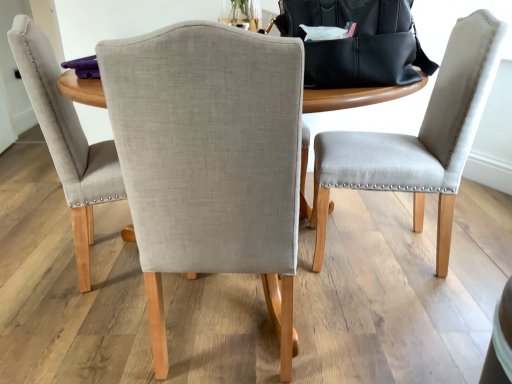
Question: From the image's perspective, is black leather messenger bag at upper center below light gray fabric chair at center, the 1th chair viewed from the left?

Choices:
 (A) no
 (B) yes

Answer: (A)

Question: Does black leather messenger bag at upper center have a greater height compared to light gray fabric chair at center, the 1th chair viewed from the left?

Choices:
 (A) yes
 (B) no

Answer: (B)

Question: Is black leather messenger bag at upper center at the right side of light gray fabric chair at center, the 1th chair viewed from the left?

Choices:
 (A) no
 (B) yes

Answer: (B)

Question: Can you confirm if black leather messenger bag at upper center is positioned to the left of light gray fabric chair at center, arranged as the 3th chair when viewed from the right?

Choices:
 (A) yes
 (B) no

Answer: (B)

Question: From a real-world perspective, is black leather messenger bag at upper center below light gray fabric chair at center, the 1th chair viewed from the left?

Choices:
 (A) yes
 (B) no

Answer: (B)

Question: Considering their positions, is light gray fabric chair at center, placed as the second chair when sorted from left to right, located in front of or behind black leather messenger bag at upper center?

Choices:
 (A) behind
 (B) front

Answer: (B)

Question: Looking at their shapes, would you say light gray fabric chair at center, the second chair in the right-to-left sequence, is wider or thinner than black leather messenger bag at upper center?

Choices:
 (A) thin
 (B) wide

Answer: (B)

Question: From the image's perspective, is light gray fabric chair at center, the second chair in the right-to-left sequence, located above or below black leather messenger bag at upper center?

Choices:
 (A) below
 (B) above

Answer: (A)

Question: Is light gray fabric chair at center, the second chair in the right-to-left sequence, taller or shorter than black leather messenger bag at upper center?

Choices:
 (A) short
 (B) tall

Answer: (B)

Question: Which is correct: light gray fabric chair at center, the second chair in the right-to-left sequence, is inside light gray fabric chair at center, arranged as the 3th chair when viewed from the right, or outside of it?

Choices:
 (A) outside
 (B) inside

Answer: (A)

Question: Would you say light gray fabric chair at center, placed as the second chair when sorted from left to right, is to the left or to the right of light gray fabric chair at center, arranged as the 3th chair when viewed from the right, in the picture?

Choices:
 (A) right
 (B) left

Answer: (A)

Question: Based on their sizes in the image, would you say light gray fabric chair at center, the second chair in the right-to-left sequence, is bigger or smaller than light gray fabric chair at center, arranged as the 3th chair when viewed from the right?

Choices:
 (A) big
 (B) small

Answer: (B)

Question: From the image's perspective, is light gray fabric chair at center, the second chair in the right-to-left sequence, located above or below light gray fabric chair at center, arranged as the 3th chair when viewed from the right?

Choices:
 (A) above
 (B) below

Answer: (B)

Question: Which is correct: black leather messenger bag at upper center is inside light gray fabric chair at center, the second chair in the right-to-left sequence, or outside of it?

Choices:
 (A) outside
 (B) inside

Answer: (A)

Question: From a real-world perspective, is black leather messenger bag at upper center physically located above or below light gray fabric chair at center, the second chair in the right-to-left sequence?

Choices:
 (A) above
 (B) below

Answer: (A)